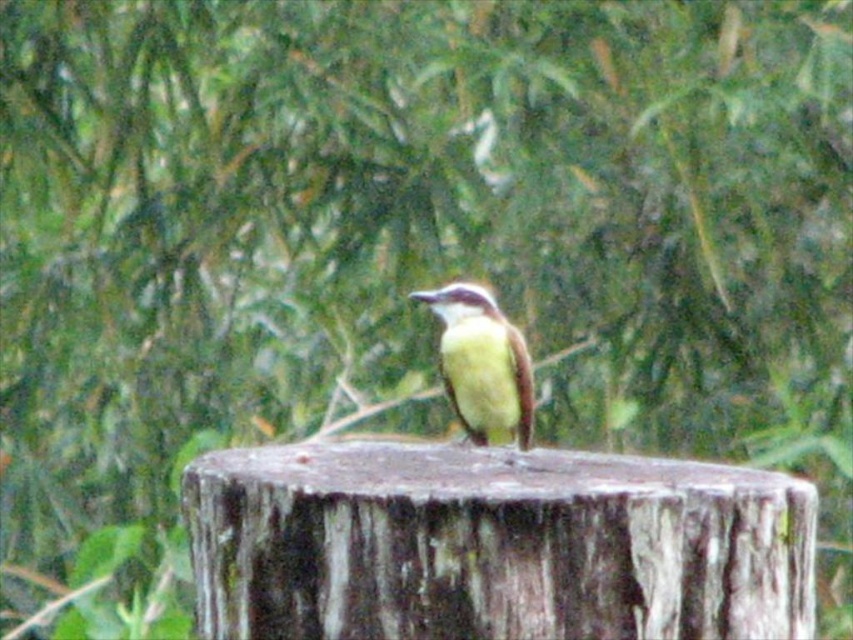
Can you confirm if rough bark stump at center is wider than yellow matte bird at center?

Indeed, rough bark stump at center has a greater width compared to yellow matte bird at center.

Does rough bark stump at center have a smaller size compared to yellow matte bird at center?

Actually, rough bark stump at center might be larger than yellow matte bird at center.

Is point (769, 508) positioned in front of point (468, 368)?

Yes.

Image resolution: width=853 pixels, height=640 pixels. I want to click on rough bark stump at center, so click(x=494, y=545).